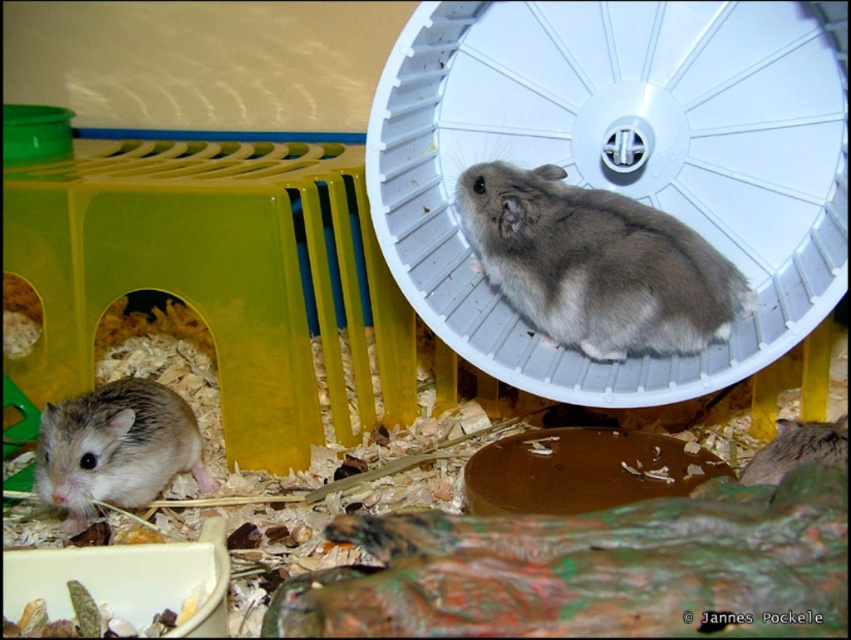
You are observing two points inside the hamsters enclosure. The first point is at coordinate point [607,278] and the second is at coordinate point [169,401]. Which point is closer to you from your current viewpoint?

Point [607,278] is in front of point [169,401], so it is closer to you.

You are a small animal handler who needs to place a food bowl in the enclosure. The bowl requires a flat surface at least 1 meter away from the camera to ensure the hamsters can easily access it. Is the point at coordinates point (587, 211) suitable for placing the food bowl?

The distance of point (587, 211) from the camera is 1.17 meters, which is more than 1 meter away. Therefore, the point is suitable for placing the food bowl as it meets the distance requirement.

You are a new hamster in the enclosure and want to approach the fuzzy gray hamster at center. From your current position near the brown fuzzy hamster at lower left, which direction should you move?

You should move to the right to reach the fuzzy gray hamster at center since it is located to the right of the brown fuzzy hamster at lower left.